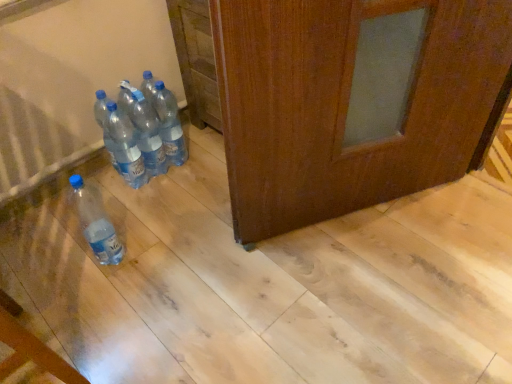
This screenshot has height=384, width=512. In order to click on vacant space to the right of transparent plastic bottles at center, acting as the 4th bottle starting from the left in this screenshot , I will do `click(206, 165)`.